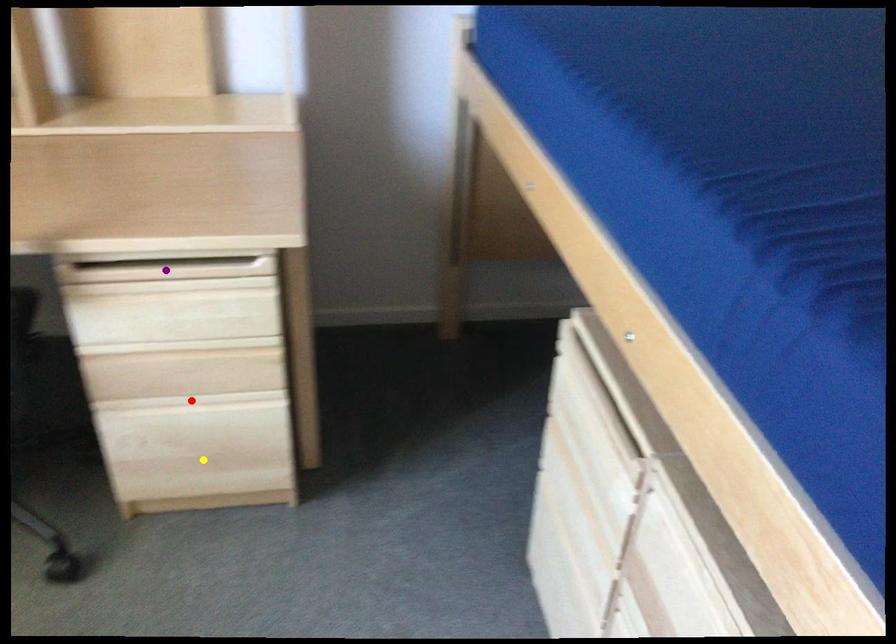
Order these from nearest to farthest:
A) purple point
B) yellow point
C) red point

purple point < red point < yellow point